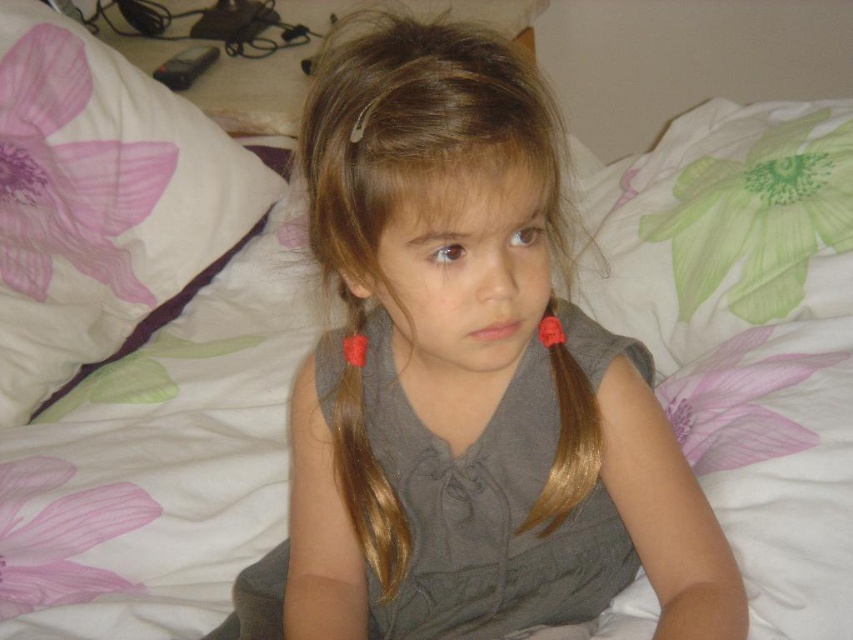
Question: Estimate the real-world distances between objects in this image. Which object is farther from the shiny golden hair at center?

Choices:
 (A) gray matte dress at center
 (B) white fabric pillow at upper left
 (C) golden smooth hair at center
 (D) matte gray shirt at center

Answer: (B)

Question: Which point is closer to the camera?

Choices:
 (A) (492, 616)
 (B) (398, 504)
 (C) (590, 477)
 (D) (553, 518)

Answer: (C)

Question: Does shiny golden hair at center appear on the left side of golden smooth hair at center?

Choices:
 (A) no
 (B) yes

Answer: (B)

Question: Estimate the real-world distances between objects in this image. Which object is closer to the shiny golden hair at center?

Choices:
 (A) white fabric pillow at upper left
 (B) golden smooth hair at center

Answer: (B)

Question: Can you confirm if white fabric pillow at upper left is positioned above shiny golden hair at center?

Choices:
 (A) yes
 (B) no

Answer: (A)

Question: Does white fabric pillow at upper left appear over shiny golden hair at center?

Choices:
 (A) no
 (B) yes

Answer: (B)